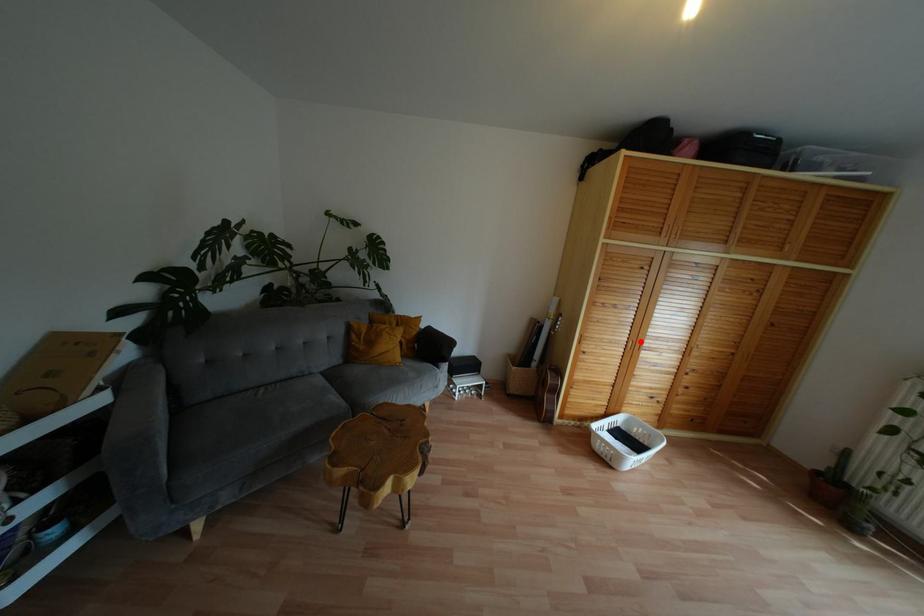
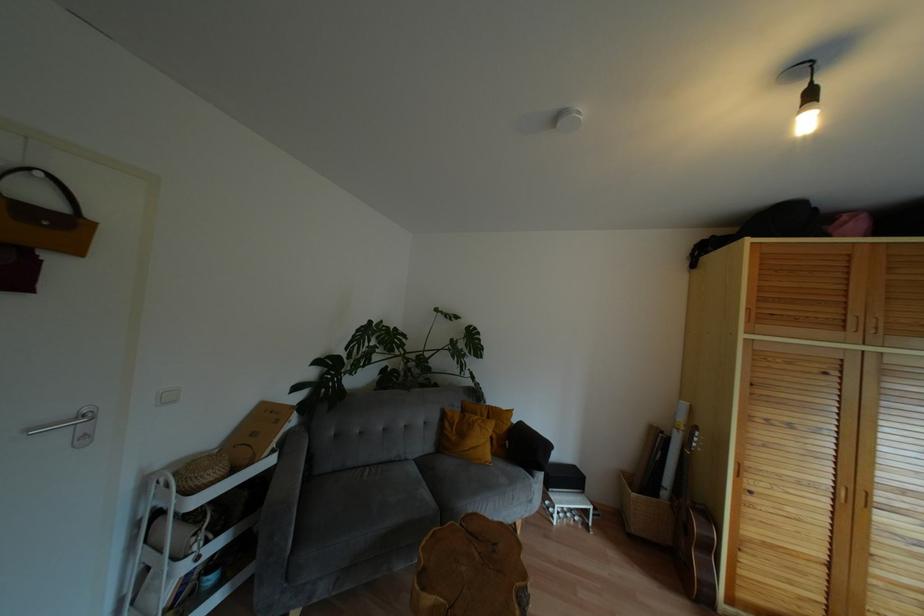
Where in the second image is the point corresponding to the highlighted location from the first image?

(867, 493)